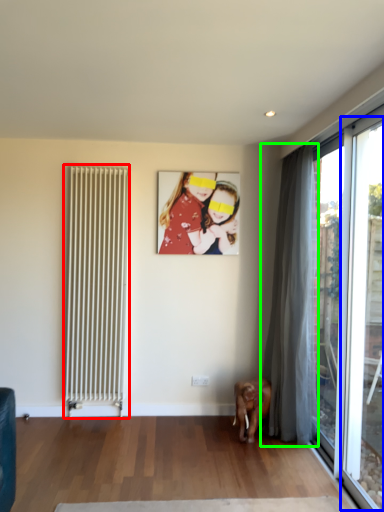
Question: Considering the real-world distances, which object is closest to radiator (highlighted by a red box)? window (highlighted by a blue box) or curtain (highlighted by a green box).

Choices:
 (A) window
 (B) curtain

Answer: (B)